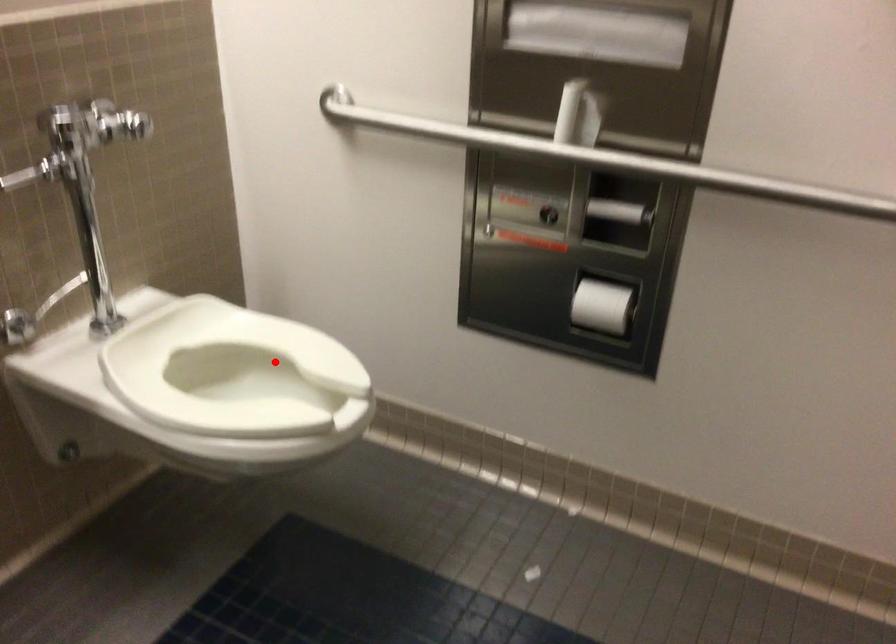
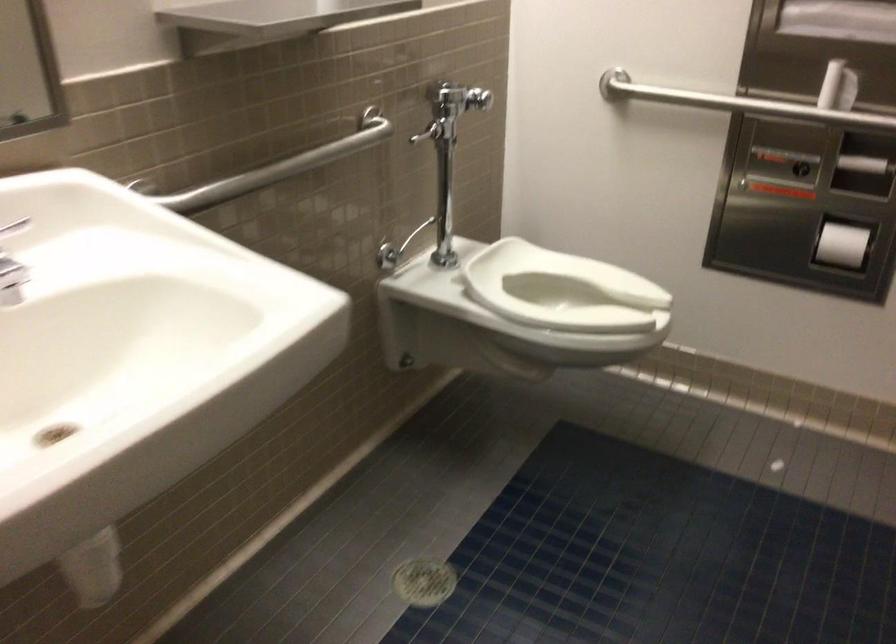
Question: I am providing you with two images of the same scene from different viewpoints. In image1, a red point is highlighted. Considering the same 3D point in image2, which of the following is correct?

Choices:
 (A) It is closer
 (B) It is farther

Answer: (B)